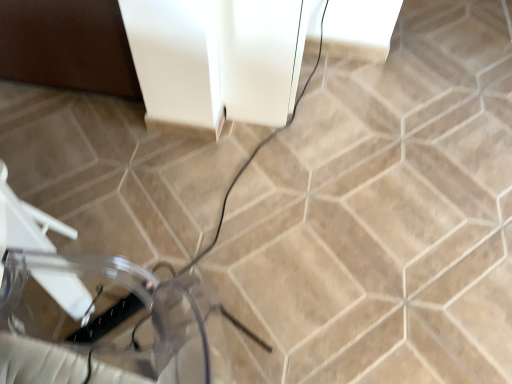
Question: Should I look upward or downward to see transparent plastic swivel chair at lower left?

Choices:
 (A) up
 (B) down

Answer: (B)